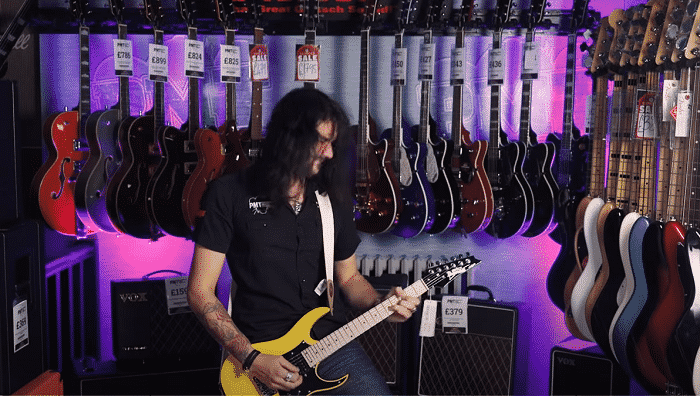
Where is `wall`? wall is located at coordinates (105, 64).